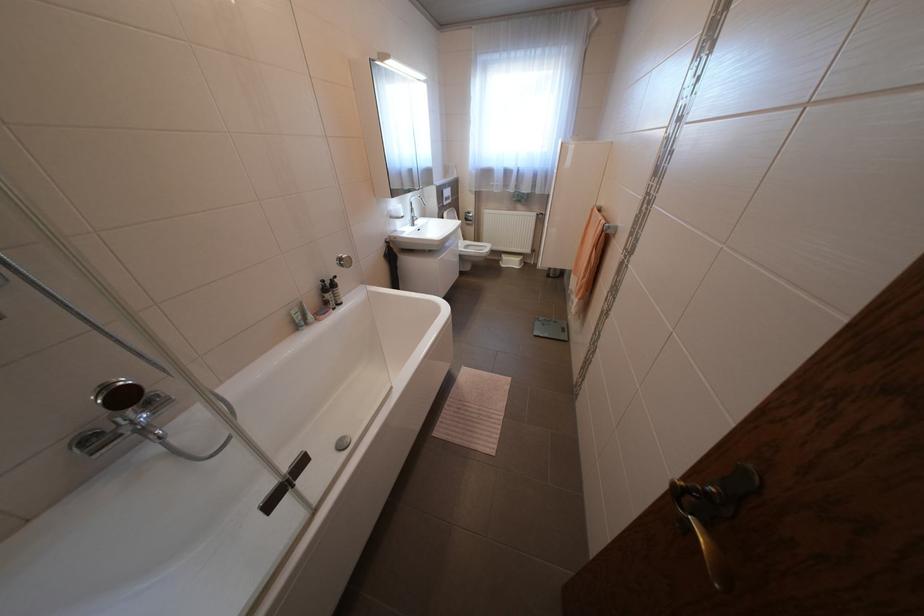
The location [302,313] corresponds to which object?

This point indicates the pink bar of soap.